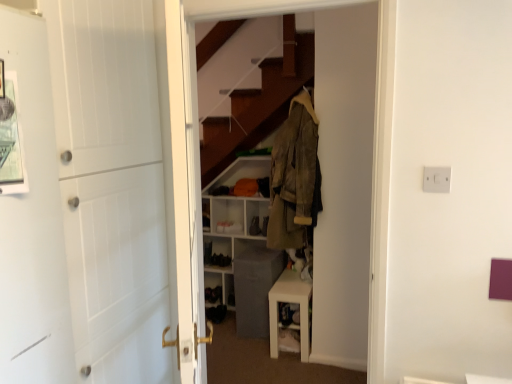
Question: Which direction should I rotate to look at black fabric shoe at lower center, the third shoe positioned from the top, — up or down?

Choices:
 (A) up
 (B) down

Answer: (B)

Question: From a real-world perspective, is leather-like brown coat at center positioned under white matte door at left based on gravity?

Choices:
 (A) no
 (B) yes

Answer: (A)

Question: From the image's perspective, is leather-like brown coat at center located above white matte door at left?

Choices:
 (A) no
 (B) yes

Answer: (B)

Question: Could white matte door at left be considered to be inside leather-like brown coat at center?

Choices:
 (A) yes
 (B) no

Answer: (B)

Question: Can you confirm if leather-like brown coat at center is wider than white matte door at left?

Choices:
 (A) no
 (B) yes

Answer: (A)

Question: Does leather-like brown coat at center have a larger size compared to white matte door at left?

Choices:
 (A) yes
 (B) no

Answer: (B)

Question: Does leather-like brown coat at center lie behind white matte door at left?

Choices:
 (A) no
 (B) yes

Answer: (B)

Question: From a real-world perspective, is black leather shoe at lower center, marked as the 3th shoe in a right-to-left arrangement, beneath matte black shoe at center, the 3th shoe positioned from the bottom?

Choices:
 (A) no
 (B) yes

Answer: (B)

Question: Can you confirm if black leather shoe at lower center, which is counted as the first shoe, starting from the left, is positioned to the right of matte black shoe at center, placed as the 3th shoe when sorted from left to right?

Choices:
 (A) no
 (B) yes

Answer: (A)

Question: Is the depth of black leather shoe at lower center, the second shoe positioned from the bottom, greater than that of matte black shoe at center, the first shoe from the right?

Choices:
 (A) yes
 (B) no

Answer: (A)

Question: Could you tell me if black leather shoe at lower center, arranged as the 2th shoe when viewed from the top, is facing matte black shoe at center, the first shoe from the right?

Choices:
 (A) yes
 (B) no

Answer: (B)

Question: Does black leather shoe at lower center, marked as the 3th shoe in a right-to-left arrangement, lie in front of matte black shoe at center, the 3th shoe positioned from the bottom?

Choices:
 (A) no
 (B) yes

Answer: (A)

Question: From a real-world perspective, is black leather shoe at lower center, the second shoe positioned from the bottom, physically above matte black shoe at center, the first shoe from the right?

Choices:
 (A) yes
 (B) no

Answer: (B)

Question: From the image's perspective, is white matte door at left beneath leather-like brown coat at center?

Choices:
 (A) no
 (B) yes

Answer: (B)